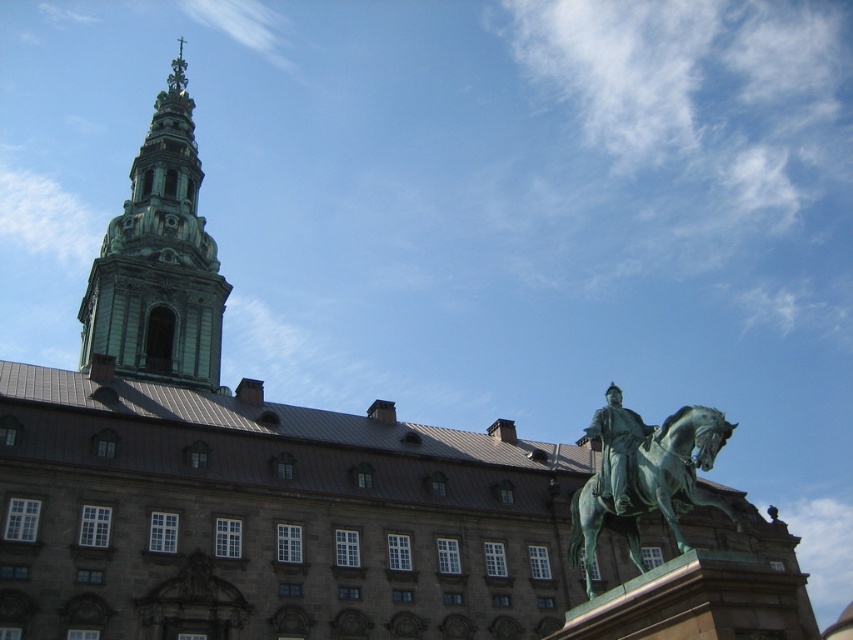
Which is in front, point (602, 445) or point (610, 497)?

Positioned in front is point (610, 497).

Where is `green polished metal horse at center`? green polished metal horse at center is located at coordinates (653, 486).

Is green stone tower at upper left to the right of green polished metal horse at center from the viewer's perspective?

No, green stone tower at upper left is not to the right of green polished metal horse at center.

In order to click on green stone tower at upper left in this screenshot , I will do `click(158, 260)`.

Locate an element on the screen. green stone tower at upper left is located at coordinates (158, 260).

Who is lower down, green stone tower at upper left or green polished bronze statue at right?

green polished bronze statue at right

Between point (173, 196) and point (630, 480), which one is positioned behind?

Positioned behind is point (173, 196).

Locate an element on the screen. The height and width of the screenshot is (640, 853). green stone tower at upper left is located at coordinates (158, 260).